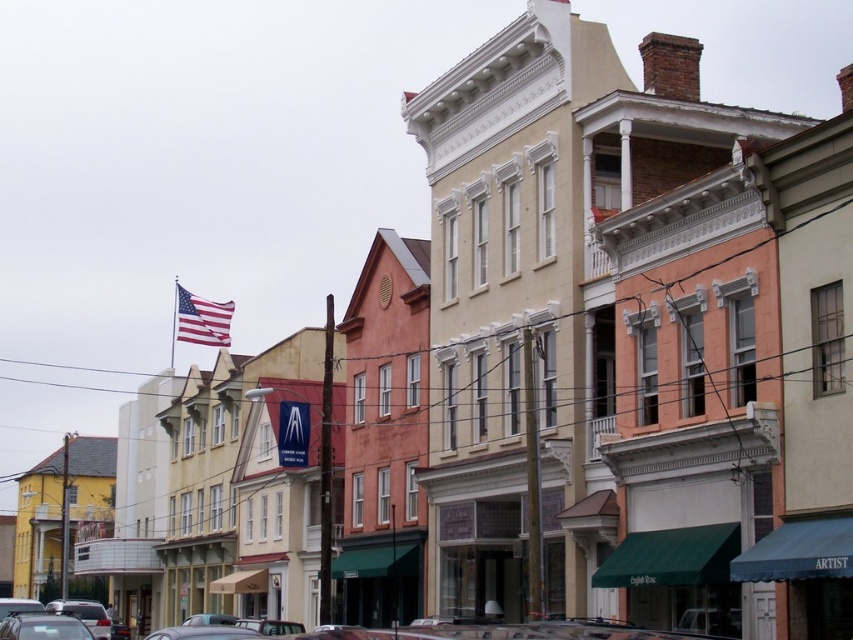
Question: Does metallic silver car at lower center have a larger size compared to american flag at upper center?

Choices:
 (A) no
 (B) yes

Answer: (A)

Question: Is metallic silver car at lower center bigger than american flag at upper center?

Choices:
 (A) no
 (B) yes

Answer: (A)

Question: Can you confirm if metallic silver car at lower center is wider than american flag at upper center?

Choices:
 (A) yes
 (B) no

Answer: (B)

Question: Which of the following is the closest to the observer?

Choices:
 (A) (219, 336)
 (B) (364, 634)

Answer: (B)